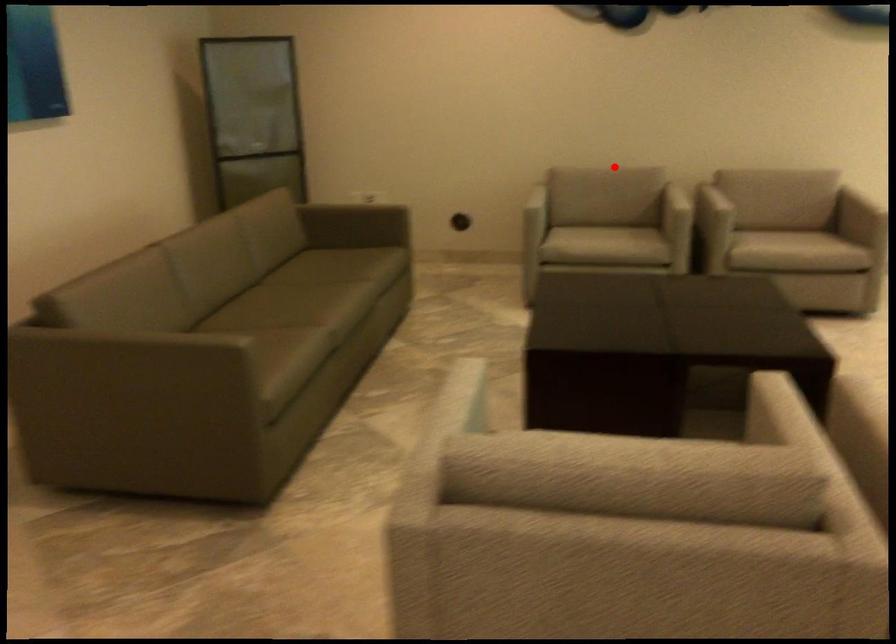
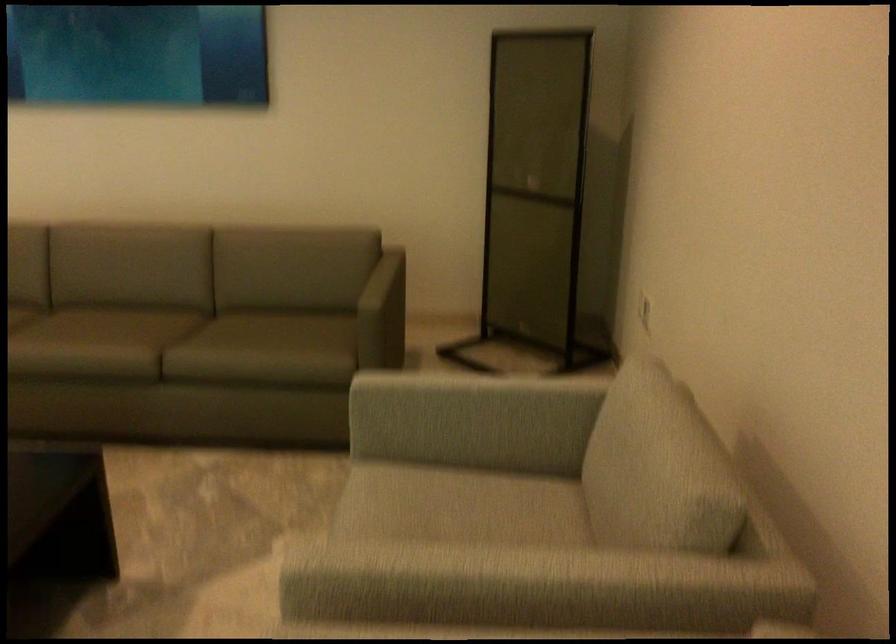
In the second image, find the point that corresponds to the highlighted location in the first image.

(653, 451)